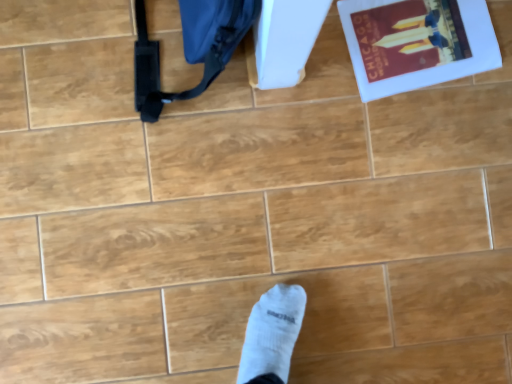
This screenshot has width=512, height=384. Identify the location of matte paper book at upper right. (415, 43).

Describe the element at coordinates (415, 43) in the screenshot. I see `matte paper book at upper right` at that location.

The width and height of the screenshot is (512, 384). What do you see at coordinates (190, 48) in the screenshot? I see `matte blue messenger bag at upper left` at bounding box center [190, 48].

This screenshot has width=512, height=384. I want to click on matte blue messenger bag at upper left, so click(190, 48).

Measure the distance between point (x=205, y=21) and camera.

Point (x=205, y=21) and camera are 26.18 inches apart.

Locate an element on the screen. The image size is (512, 384). matte paper book at upper right is located at coordinates (415, 43).

Can you confirm if matte blue messenger bag at upper left is positioned to the right of matte paper book at upper right?

No, matte blue messenger bag at upper left is not to the right of matte paper book at upper right.

Does matte blue messenger bag at upper left lie in front of matte paper book at upper right?

That is True.

Which is nearer, (x=190, y=93) or (x=406, y=67)?

Point (x=190, y=93) is positioned closer to the camera compared to point (x=406, y=67).

From the image's perspective, between matte blue messenger bag at upper left and matte paper book at upper right, which one is located above?

matte paper book at upper right, from the image's perspective.

From a real-world perspective, is matte blue messenger bag at upper left beneath matte paper book at upper right?

No, from a real-world perspective, matte blue messenger bag at upper left is not below matte paper book at upper right.

In the scene shown: Can you confirm if matte blue messenger bag at upper left is wider than matte paper book at upper right?

No, matte blue messenger bag at upper left is not wider than matte paper book at upper right.

Does matte blue messenger bag at upper left have a lesser height compared to matte paper book at upper right?

In fact, matte blue messenger bag at upper left may be taller than matte paper book at upper right.

Considering the sizes of objects matte blue messenger bag at upper left and matte paper book at upper right in the image provided, who is smaller, matte blue messenger bag at upper left or matte paper book at upper right?

With smaller size is matte paper book at upper right.

Is matte blue messenger bag at upper left completely or partially outside of matte paper book at upper right?

Indeed, matte blue messenger bag at upper left is completely outside matte paper book at upper right.

Is matte blue messenger bag at upper left placed right next to matte paper book at upper right?

There is a gap between matte blue messenger bag at upper left and matte paper book at upper right.

Consider the image. Is matte blue messenger bag at upper left facing towards matte paper book at upper right?

No, matte blue messenger bag at upper left is not aimed at matte paper book at upper right.

Locate an element on the screen. The width and height of the screenshot is (512, 384). messenger bag above the matte paper book at upper right (from a real-world perspective) is located at coordinates (190, 48).

Which is more to the right, matte paper book at upper right or matte blue messenger bag at upper left?

From the viewer's perspective, matte paper book at upper right appears more on the right side.

Which object is more forward, matte paper book at upper right or matte blue messenger bag at upper left?

matte blue messenger bag at upper left is more forward.

Considering the positions of point (486, 53) and point (238, 21), is point (486, 53) closer or farther from the camera than point (238, 21)?

Point (486, 53) is positioned farther from the camera compared to point (238, 21).

From the image's perspective, is matte paper book at upper right under matte blue messenger bag at upper left?

No, from the image's perspective, matte paper book at upper right is not beneath matte blue messenger bag at upper left.

From a real-world perspective, who is located higher, matte paper book at upper right or matte blue messenger bag at upper left?

matte blue messenger bag at upper left.

Considering the sizes of matte paper book at upper right and matte blue messenger bag at upper left in the image, is matte paper book at upper right wider or thinner than matte blue messenger bag at upper left?

In the image, matte paper book at upper right appears to be wider than matte blue messenger bag at upper left.

Who is shorter, matte paper book at upper right or matte blue messenger bag at upper left?

matte paper book at upper right is shorter.

Based on the photo, looking at the image, does matte paper book at upper right seem bigger or smaller compared to matte blue messenger bag at upper left?

Considering their sizes, matte paper book at upper right takes up less space than matte blue messenger bag at upper left.

Does matte paper book at upper right contain matte blue messenger bag at upper left?

No, matte blue messenger bag at upper left is located outside of matte paper book at upper right.

Are matte paper book at upper right and matte blue messenger bag at upper left beside each other?

No.

Is matte paper book at upper right facing towards matte blue messenger bag at upper left?

Yes, matte paper book at upper right faces towards matte blue messenger bag at upper left.

The width and height of the screenshot is (512, 384). Identify the location of messenger bag that is on the left side of matte paper book at upper right. (190, 48).

What are the coordinates of `paperback book on the right side of matte blue messenger bag at upper left` in the screenshot? It's located at (415, 43).

This screenshot has width=512, height=384. In order to click on paperback book below the matte blue messenger bag at upper left (from a real-world perspective) in this screenshot , I will do `click(415, 43)`.